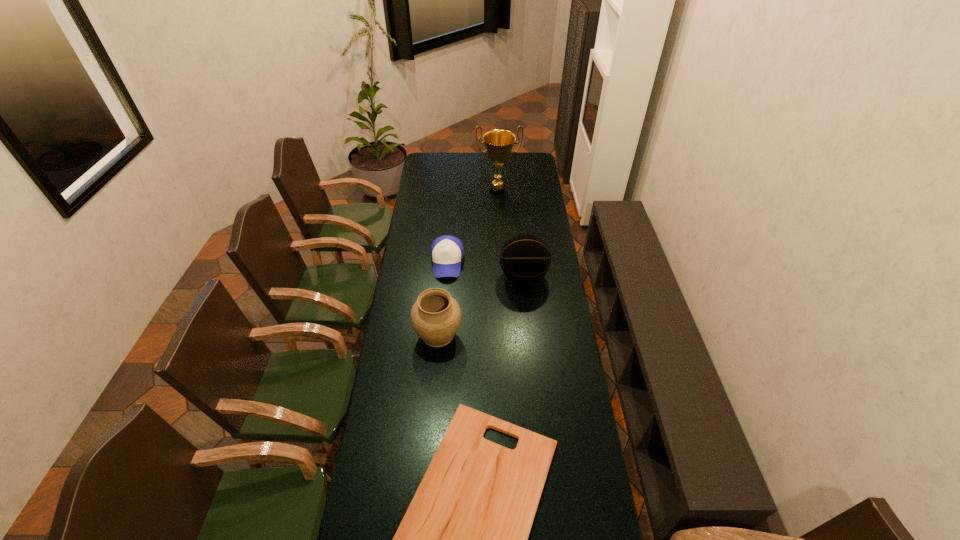
This screenshot has height=540, width=960. What are the coordinates of `baseball cap present at the left edge` in the screenshot? It's located at (447, 252).

Image resolution: width=960 pixels, height=540 pixels. I want to click on award present at the right edge, so click(x=498, y=143).

Where is `basketball that is at the right edge`? basketball that is at the right edge is located at coordinates (525, 258).

You are a GUI agent. You are given a task and a screenshot of the screen. Output one action in this format:
    pyautogui.click(x=<x>, y=<y>)
    Task: Click on the blank space at the far edge
    This screenshot has width=960, height=540.
    Given the screenshot: What is the action you would take?
    [470, 170]

Where is `vacant space at the left edge of the desktop`? The width and height of the screenshot is (960, 540). vacant space at the left edge of the desktop is located at coordinates (414, 443).

Find the location of a particular element. vacant space at the right edge of the desktop is located at coordinates (552, 350).

You are a GUI agent. You are given a task and a screenshot of the screen. Output one action in this format:
    pyautogui.click(x=<x>, y=<y>)
    Task: Click on the vacant space at the far left corner of the desktop
    This screenshot has width=960, height=540.
    Given the screenshot: What is the action you would take?
    pyautogui.click(x=436, y=171)

Where is `vacant space at the far right corner`? This screenshot has width=960, height=540. vacant space at the far right corner is located at coordinates (535, 166).

Where is `vacant area between the award and the fourth tallest object`? The height and width of the screenshot is (540, 960). vacant area between the award and the fourth tallest object is located at coordinates (472, 226).

The height and width of the screenshot is (540, 960). Find the location of `empty location between the basketball and the second shortest object`. empty location between the basketball and the second shortest object is located at coordinates (485, 270).